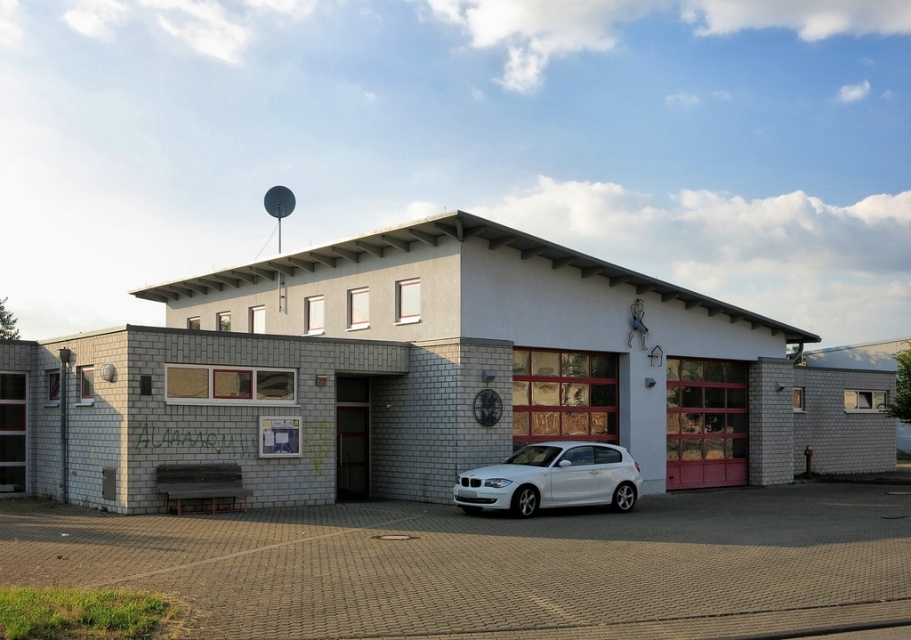
You are a delivery driver approaching the white brick fire station at center and the white glossy hatchback at center. Which vehicle can you park closer to the entrance without blocking the garage doors?

The white glossy hatchback at center can be parked closer to the entrance without blocking the garage doors since it is smaller in size than the white brick fire station at center.

You are a delivery driver approaching the white brick fire station at center and the white glossy hatchback at center. Which one is closer to you as you arrive?

The white brick fire station at center is closer to you because it is in front of the white glossy hatchback at center.